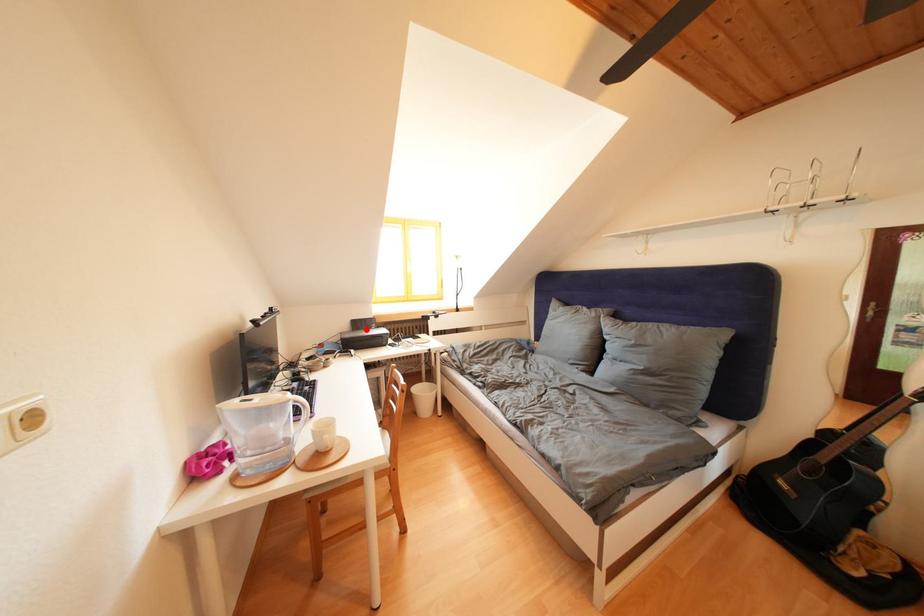
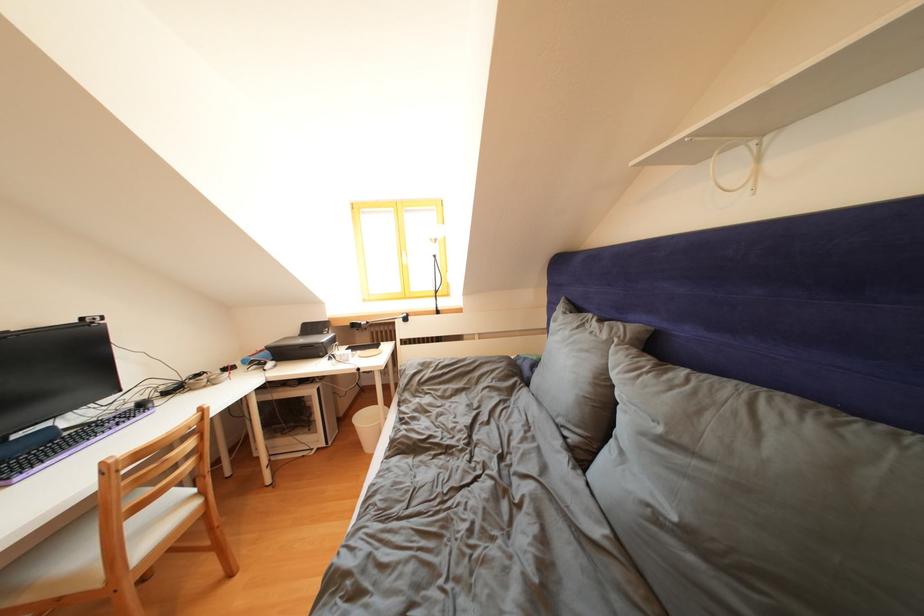
In the second image, find the point that corresponds to the highlighted location in the first image.

(319, 333)